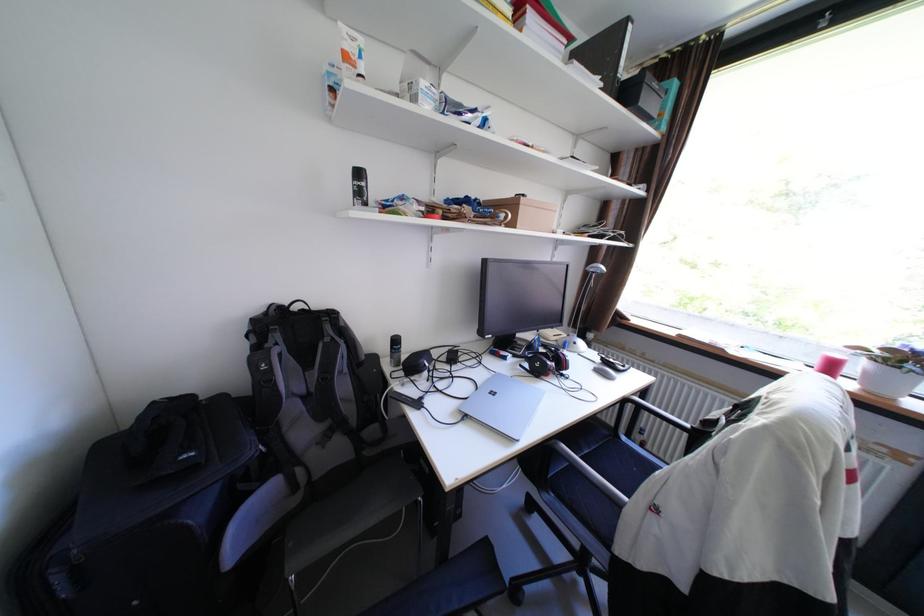
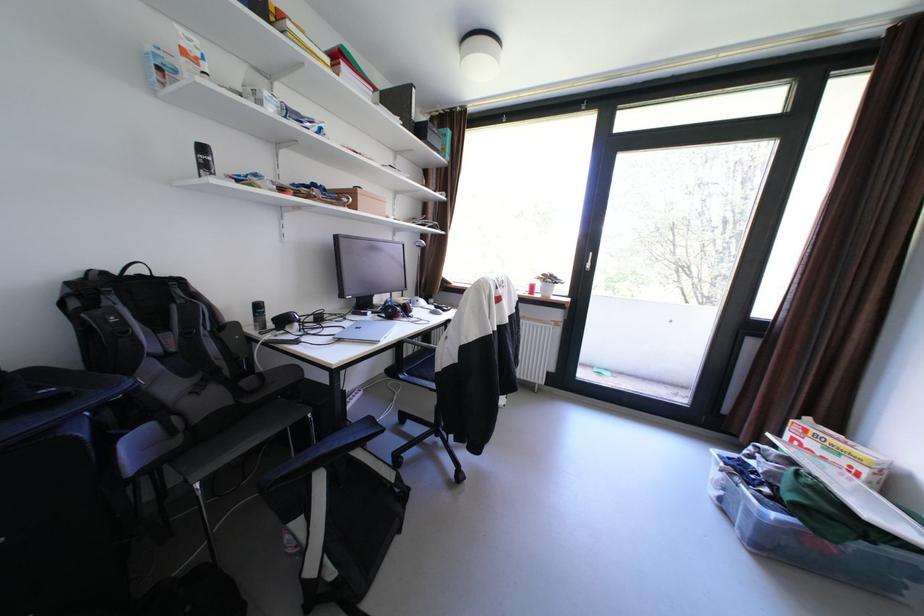
Locate, in the second image, the point that corresponds to point (520, 357) in the first image.

(380, 313)